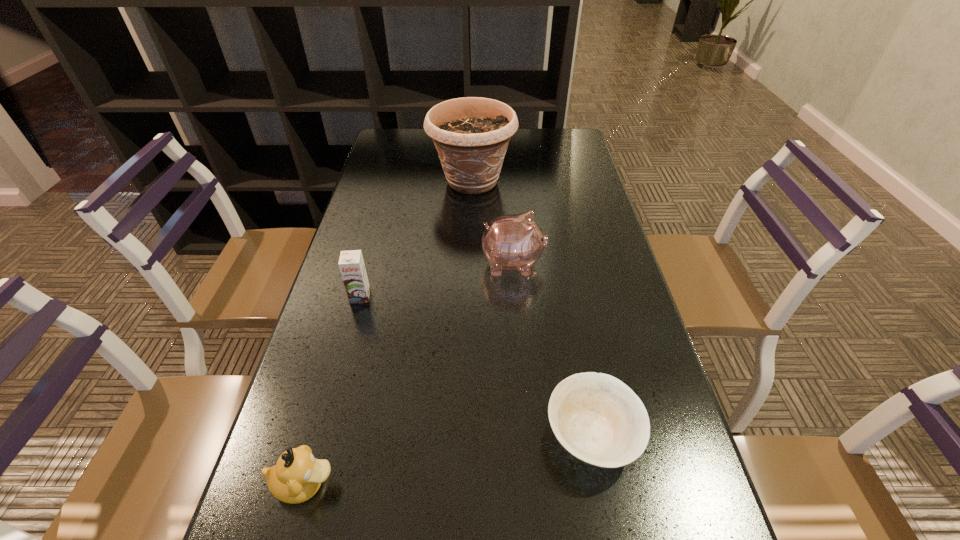
Image resolution: width=960 pixels, height=540 pixels. In order to click on vacant position located 0.400m on the back of the shortest object in this screenshot , I will do `click(559, 260)`.

Where is `chocolate milk positioned at the left edge`? This screenshot has height=540, width=960. chocolate milk positioned at the left edge is located at coordinates (351, 264).

Locate an element on the screen. This screenshot has width=960, height=540. duckling located in the left edge section of the desktop is located at coordinates [297, 476].

Where is `object located at the right edge`? Image resolution: width=960 pixels, height=540 pixels. object located at the right edge is located at coordinates (598, 419).

Find the location of `vacant area at the left edge of the desktop`. vacant area at the left edge of the desktop is located at coordinates click(x=313, y=515).

Find the location of `vacant space at the right edge`. vacant space at the right edge is located at coordinates (573, 164).

The image size is (960, 540). In order to click on empty location between the flowerpot and the bowl in this screenshot , I will do `click(532, 308)`.

Image resolution: width=960 pixels, height=540 pixels. I want to click on free space between the farthest object and the shortest object, so click(x=532, y=308).

Where is `empty space that is in between the piggy bank and the third nearest object`? The image size is (960, 540). empty space that is in between the piggy bank and the third nearest object is located at coordinates (437, 280).

Image resolution: width=960 pixels, height=540 pixels. In order to click on vacant point located between the piggy bank and the fourth tallest object in this screenshot , I will do `click(409, 374)`.